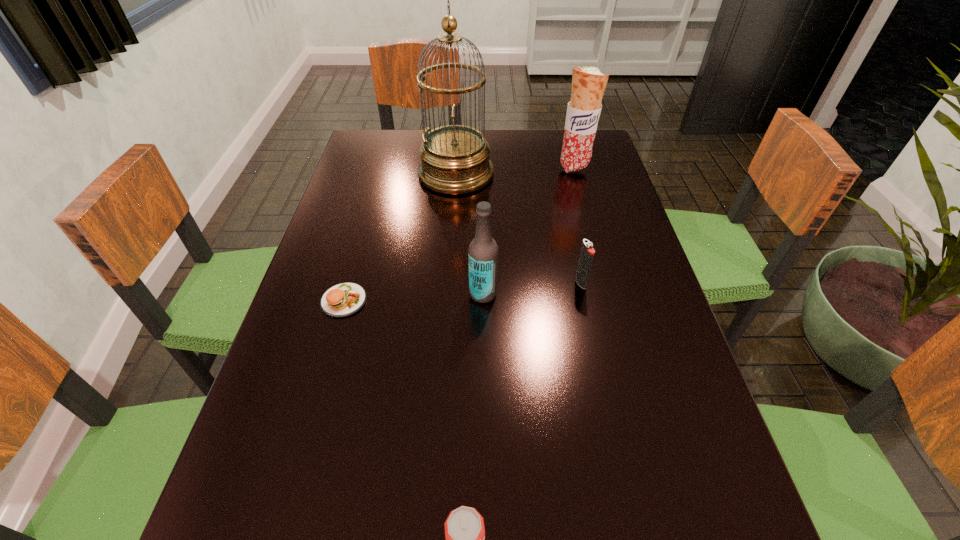
Where is `free spot between the burrito and the leftmost object`? This screenshot has width=960, height=540. free spot between the burrito and the leftmost object is located at coordinates (459, 234).

Where is `free area in between the fourth tallest object and the shortest object`? This screenshot has height=540, width=960. free area in between the fourth tallest object and the shortest object is located at coordinates (463, 292).

At what (x,y) coordinates should I click in order to perform the action: click on free space between the shortest object and the igniter. Please return your answer as a coordinate pair (x, y). The image size is (960, 540). Looking at the image, I should click on (463, 292).

Where is `object that stands as the fourth closest to the beer can`? object that stands as the fourth closest to the beer can is located at coordinates tap(455, 159).

Point out which object is positioned as the fourth nearest to the beer can. Please provide its 2D coordinates. Your answer should be formatted as a tuple, i.e. [(x, y)], where the tuple contains the x and y coordinates of a point satisfying the conditions above.

[(455, 159)]

Where is `free spot that satisfies the following two spatial constraints: 1. with an open door on the birdcage; 2. on the left side of the fourth tallest object`? The image size is (960, 540). free spot that satisfies the following two spatial constraints: 1. with an open door on the birdcage; 2. on the left side of the fourth tallest object is located at coordinates (448, 283).

Where is `vacant area that satisfies the following two spatial constraints: 1. on the front side of the burrito; 2. on the side of the beer bottle with the label`? The height and width of the screenshot is (540, 960). vacant area that satisfies the following two spatial constraints: 1. on the front side of the burrito; 2. on the side of the beer bottle with the label is located at coordinates (608, 293).